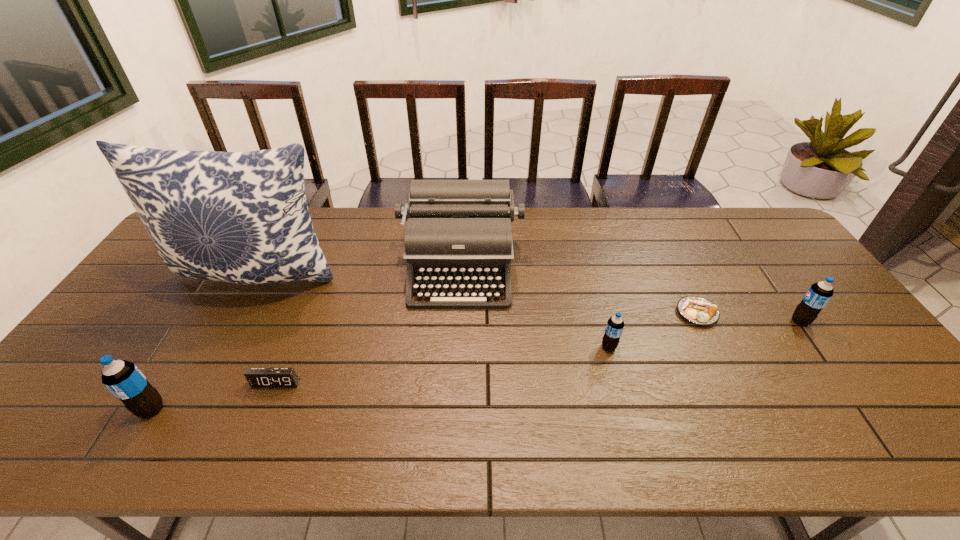
Where is `free spot that satisfies the following two spatial constraints: 1. on the front surface of the tallest object; 2. on the right side of the shortest object`? The image size is (960, 540). free spot that satisfies the following two spatial constraints: 1. on the front surface of the tallest object; 2. on the right side of the shortest object is located at coordinates (238, 313).

Locate an element on the screen. The width and height of the screenshot is (960, 540). vacant space that satisfies the following two spatial constraints: 1. on the back side of the tallest soda bottle; 2. on the right side of the shortest object is located at coordinates (209, 313).

Where is `vacant space that satisfies the following two spatial constraints: 1. on the front surface of the sixth object from left to right; 2. on the right side of the cushion`? The height and width of the screenshot is (540, 960). vacant space that satisfies the following two spatial constraints: 1. on the front surface of the sixth object from left to right; 2. on the right side of the cushion is located at coordinates (238, 313).